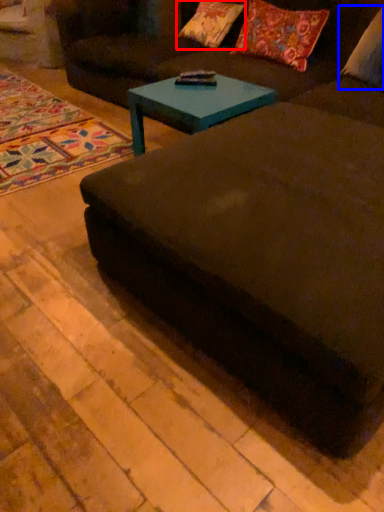
Question: Which object appears closest to the camera in this image, pillow (highlighted by a red box) or pillow (highlighted by a blue box)?

Choices:
 (A) pillow
 (B) pillow

Answer: (B)